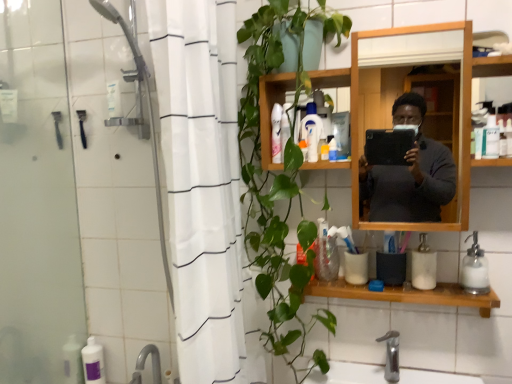
Question: Considering the relative sizes of purple matte bottle at lower left, the first toiletry in the back-to-front sequence, and translucent plastic bottle at center, the third toiletry in the bottom-to-top sequence, in the image provided, is purple matte bottle at lower left, the first toiletry in the back-to-front sequence, shorter than translucent plastic bottle at center, the third toiletry in the bottom-to-top sequence,?

Choices:
 (A) no
 (B) yes

Answer: (A)

Question: Is purple matte bottle at lower left, which is the first toiletry in left-to-right order, taller than translucent plastic bottle at center, the third toiletry viewed from the right?

Choices:
 (A) yes
 (B) no

Answer: (A)

Question: Considering the relative positions of purple matte bottle at lower left, the first toiletry in the back-to-front sequence, and translucent plastic bottle at center, which is the 4th toiletry in back-to-front order, in the image provided, is purple matte bottle at lower left, the first toiletry in the back-to-front sequence, to the right of translucent plastic bottle at center, which is the 4th toiletry in back-to-front order, from the viewer's perspective?

Choices:
 (A) no
 (B) yes

Answer: (A)

Question: From a real-world perspective, is purple matte bottle at lower left, the 1th toiletry ordered from the bottom, located beneath translucent plastic bottle at center, which is the 4th toiletry in back-to-front order?

Choices:
 (A) yes
 (B) no

Answer: (A)

Question: Considering the relative positions of purple matte bottle at lower left, the 8th toiletry in the top-to-bottom sequence, and translucent plastic bottle at center, the sixth toiletry from the left, in the image provided, is purple matte bottle at lower left, the 8th toiletry in the top-to-bottom sequence, behind translucent plastic bottle at center, the sixth toiletry from the left,?

Choices:
 (A) no
 (B) yes

Answer: (B)

Question: Is wooden shelf at lower center wider or thinner than translucent plastic bottle at center, the sixth toiletry from the left?

Choices:
 (A) thin
 (B) wide

Answer: (B)

Question: Is wooden shelf at lower center inside or outside of translucent plastic bottle at center, the third toiletry in the bottom-to-top sequence?

Choices:
 (A) outside
 (B) inside

Answer: (A)

Question: From the image's perspective, is wooden shelf at lower center located above or below translucent plastic bottle at center, the 6th toiletry viewed from the top?

Choices:
 (A) below
 (B) above

Answer: (A)

Question: Is wooden shelf at lower center taller or shorter than translucent plastic bottle at center, the sixth toiletry from the left?

Choices:
 (A) short
 (B) tall

Answer: (B)

Question: Considering the positions of point (303, 122) and point (472, 284), is point (303, 122) closer or farther from the camera than point (472, 284)?

Choices:
 (A) farther
 (B) closer

Answer: (B)

Question: From the image's perspective, is white plastic bottle at upper center, marked as the 4th toiletry in a right-to-left arrangement, located above or below white glass soap dispenser at lower right, acting as the 2th soap dispenser starting from the left?

Choices:
 (A) below
 (B) above

Answer: (B)

Question: Relative to white glass soap dispenser at lower right, the 1th soap dispenser when ordered from right to left, is white plastic bottle at upper center, arranged as the 8th toiletry when ordered from the bottom, in front or behind?

Choices:
 (A) behind
 (B) front

Answer: (A)

Question: Considering the positions of white plastic bottle at upper center, which is counted as the first toiletry, starting from the top, and white glass soap dispenser at lower right, acting as the 2th soap dispenser starting from the left, in the image, is white plastic bottle at upper center, which is counted as the first toiletry, starting from the top, taller or shorter than white glass soap dispenser at lower right, acting as the 2th soap dispenser starting from the left,?

Choices:
 (A) short
 (B) tall

Answer: (B)

Question: Is wooden shelf at lower center in front of or behind white plastic bottle at upper center, arranged as the 8th toiletry when ordered from the bottom, in the image?

Choices:
 (A) behind
 (B) front

Answer: (B)

Question: From the image's perspective, relative to white plastic bottle at upper center, which is counted as the first toiletry, starting from the top, is wooden shelf at lower center above or below?

Choices:
 (A) below
 (B) above

Answer: (A)